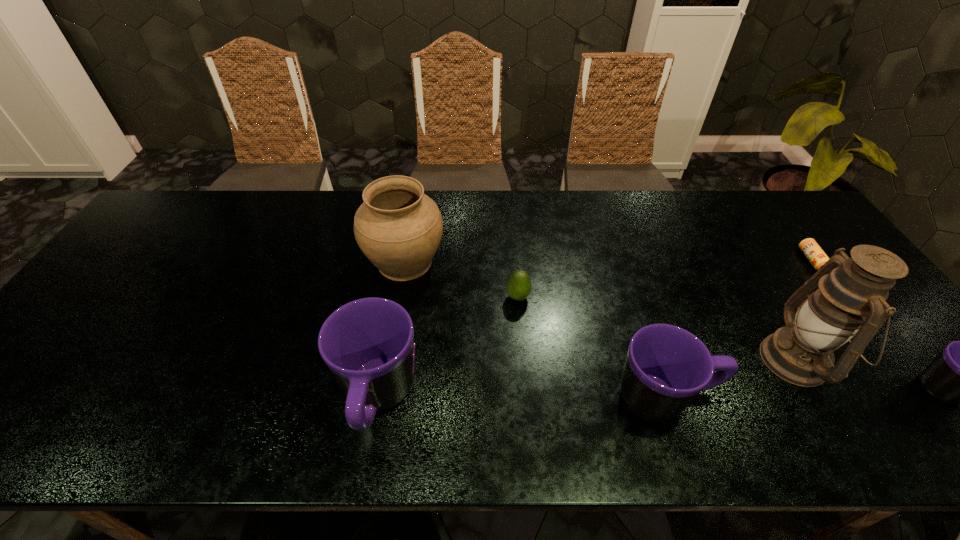
The height and width of the screenshot is (540, 960). I want to click on vacant space at the far right corner of the desktop, so click(761, 205).

Where is `vacant area that lies between the avocado and the second mug from right to left`? Image resolution: width=960 pixels, height=540 pixels. vacant area that lies between the avocado and the second mug from right to left is located at coordinates (590, 348).

This screenshot has width=960, height=540. I want to click on free spot between the leftmost mug and the fifth object from right to left, so click(448, 348).

Find the location of a particular element. The width and height of the screenshot is (960, 540). free space between the beer can and the second shortest mug is located at coordinates (737, 329).

At what (x,y) coordinates should I click in order to perform the action: click on free area in between the fifth object from right to left and the leftmost mug. Please return your answer as a coordinate pair (x, y). The image size is (960, 540). Looking at the image, I should click on (448, 348).

At what (x,y) coordinates should I click in order to perform the action: click on vacant space that's between the fourth object from left to right and the shortest object. Please return your answer as a coordinate pair (x, y). This screenshot has width=960, height=540. Looking at the image, I should click on (737, 329).

Locate an element on the screen. This screenshot has width=960, height=540. object that is the third closest to the fourth tallest object is located at coordinates (368, 344).

Where is `object that ranks as the fourth closest to the fifth object from left to right`? This screenshot has width=960, height=540. object that ranks as the fourth closest to the fifth object from left to right is located at coordinates (519, 285).

Locate which mug ranks in proximity to the leftmost mug. Please provide its 2D coordinates. Your answer should be formatted as a tuple, i.e. [(x, y)], where the tuple contains the x and y coordinates of a point satisfying the conditions above.

[(666, 367)]

At what (x,y) coordinates should I click in order to perform the action: click on mug that can be found as the closest to the urn. Please return your answer as a coordinate pair (x, y). Looking at the image, I should click on pos(368,344).